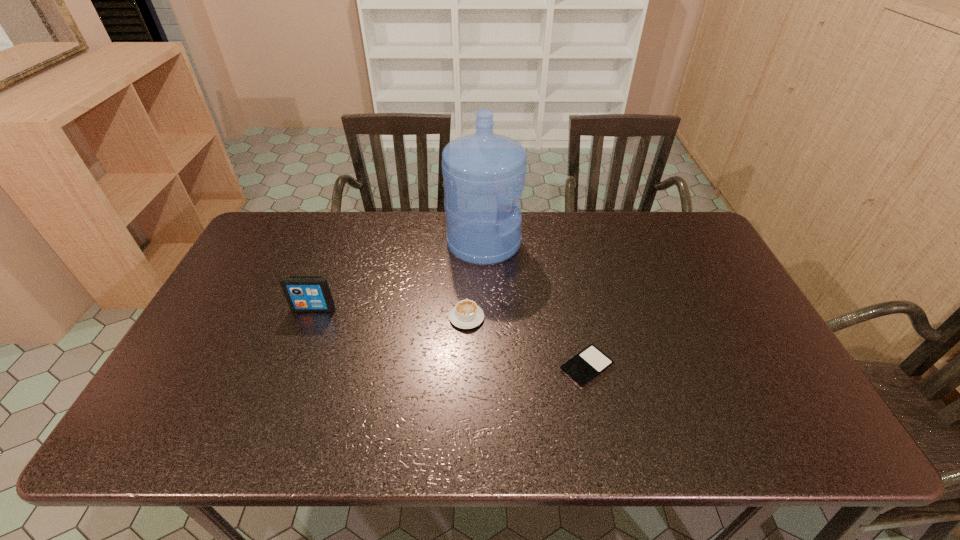
Identify the location of object that is the second closest to the nearer iPod. (484, 173).

What are the coordinates of `vacant area in the image that satisfies the following two spatial constraints: 1. on the back side of the right iPod; 2. on the side of the farthest object with the handle` in the screenshot? It's located at (560, 243).

Where is `vacant area in the image that satisfies the following two spatial constraints: 1. on the side of the water jug with the handle; 2. on the front screen of the left iPod`? This screenshot has width=960, height=540. vacant area in the image that satisfies the following two spatial constraints: 1. on the side of the water jug with the handle; 2. on the front screen of the left iPod is located at coordinates (485, 309).

The image size is (960, 540). I want to click on free space that satisfies the following two spatial constraints: 1. on the front screen of the shorter iPod; 2. on the left side of the left iPod, so click(292, 367).

I want to click on vacant space that satisfies the following two spatial constraints: 1. on the side of the farthest object with the handle; 2. on the right side of the nearer iPod, so click(485, 367).